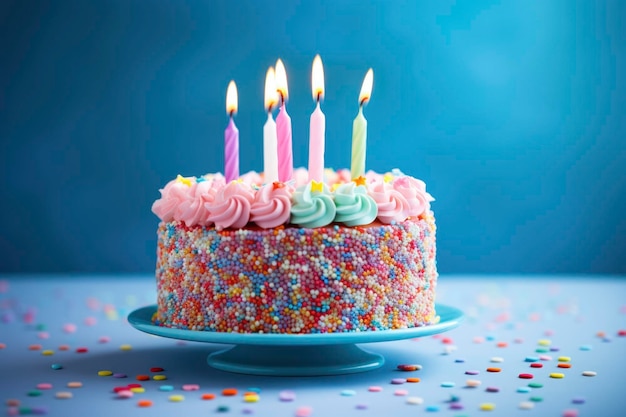
Locate an element on the screen. cake candles is located at coordinates (230, 146), (269, 140), (285, 149), (316, 144), (362, 144).